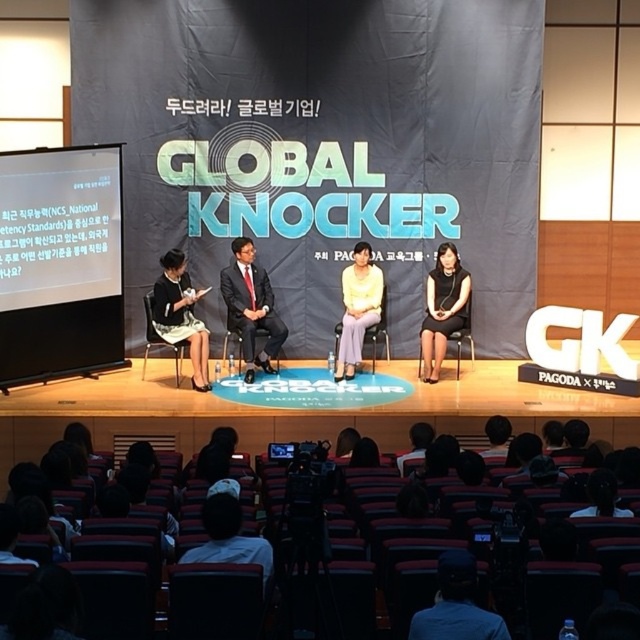
You are standing in the conference hall facing the stage. There is a point marked at coordinates [195,374] on the stage. If you want to walk directly to that point from your current position, how far will you have to walk?

The point at coordinates [195,374] is 10.65 meters away from the viewer, so you will have to walk 10.65 meters to reach it.

You are an attendee at the event and want to see the presentation slides. Which object is positioned higher, the white matte screen at left or the matte black dress at left?

The white matte screen at left is positioned higher than the matte black dress at left.